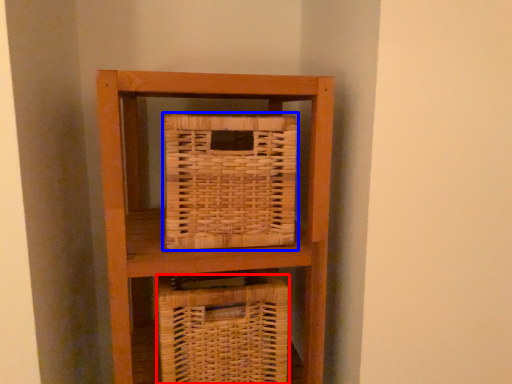
Question: Which object is further to the camera taking this photo, basket (highlighted by a red box) or picnic basket (highlighted by a blue box)?

Choices:
 (A) basket
 (B) picnic basket

Answer: (A)